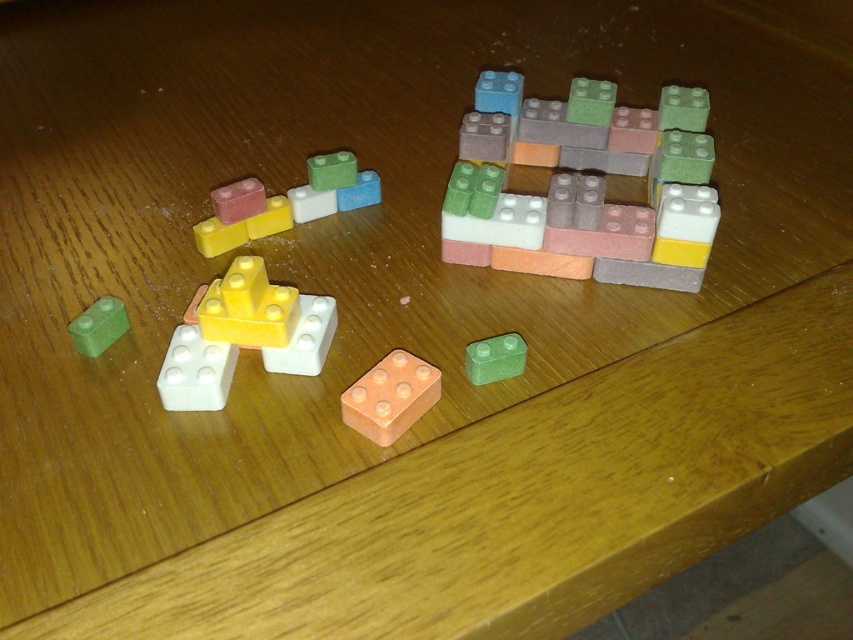
You are standing at a distance of 1.27 meters from the point marked as point (339,156) in the image. If you want to pick up a block from the main cluster on the right side, which is 1.5 meters away from you, can you reach it without moving your feet?

The distance between you and the point is 1.27 meters, but the main cluster on the right side is 1.5 meters away. Since 1.5 meters is farther than 1.27 meters, you cannot reach it without moving your feet.

You are organizing the pastel plastic blocks at upper left and the matte yellow brick at center on a shelf. If you want to place them side by side, which one should you move first to ensure they are aligned properly?

The matte yellow brick at center is behind pastel plastic blocks at upper left, so you should move the pastel plastic blocks at upper left first to make space for the matte yellow brick at center to come forward and align properly.